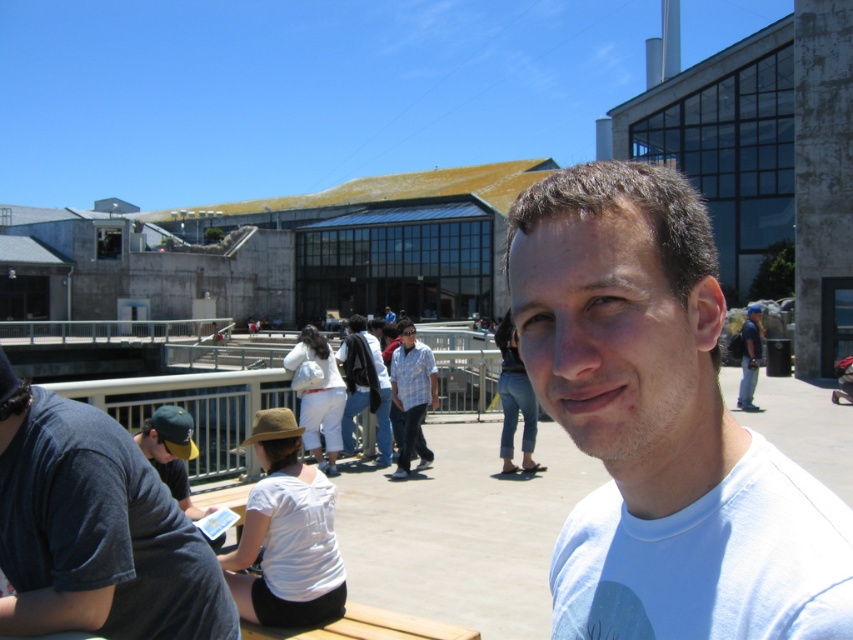
This screenshot has width=853, height=640. In order to click on white cotton t-shirt at center in this screenshot , I will do `click(660, 426)`.

Can you confirm if white cotton t-shirt at center is positioned to the right of dark blue t-shirt at left?

Correct, you'll find white cotton t-shirt at center to the right of dark blue t-shirt at left.

Who is more distant from viewer, (593, 326) or (164, 531)?

Point (164, 531)

Locate an element on the screen. Image resolution: width=853 pixels, height=640 pixels. white cotton t-shirt at center is located at coordinates (660, 426).

Can you confirm if plaid shirt at center is positioned to the right of blue denim jeans at center?

In fact, plaid shirt at center is to the left of blue denim jeans at center.

The image size is (853, 640). Find the location of `plaid shirt at center`. plaid shirt at center is located at coordinates (410, 396).

Identify the location of plaid shirt at center. Image resolution: width=853 pixels, height=640 pixels. (410, 396).

Can you confirm if dark blue t-shirt at left is positioned above plaid shirt at center?

Yes.

The image size is (853, 640). Describe the element at coordinates (96, 529) in the screenshot. I see `dark blue t-shirt at left` at that location.

The width and height of the screenshot is (853, 640). In order to click on dark blue t-shirt at left in this screenshot , I will do `click(96, 529)`.